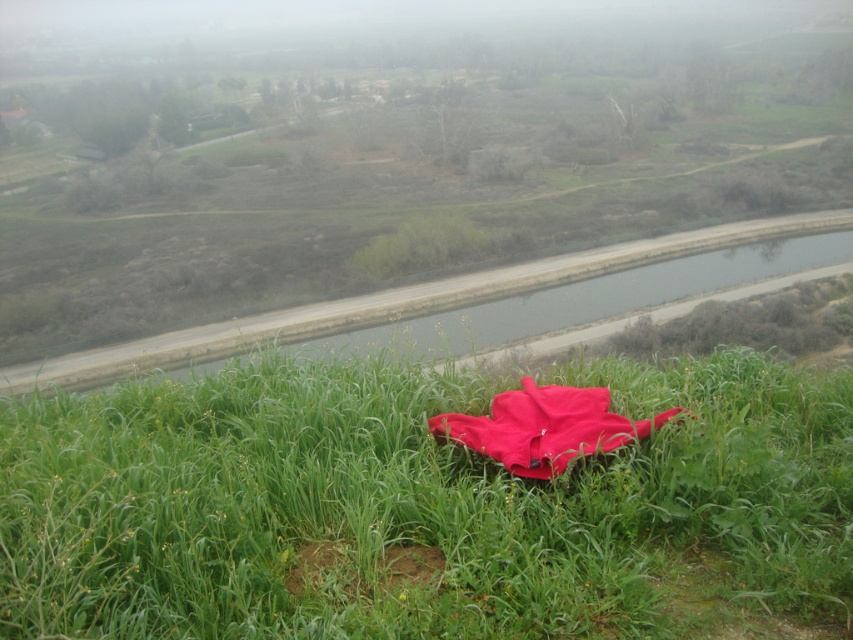
Who is more forward, (614, 413) or (357, 579)?

Point (357, 579)

Who is more distant from viewer, (547, 388) or (335, 560)?

Positioned behind is point (547, 388).

Identify the location of matte red blanket at center. (544, 428).

The width and height of the screenshot is (853, 640). I want to click on matte red blanket at center, so click(544, 428).

Who is positioned more to the left, matte red fabric at center or brown dirt patch at lower center?

From the viewer's perspective, brown dirt patch at lower center appears more on the left side.

Locate an element on the screen. This screenshot has height=640, width=853. matte red fabric at center is located at coordinates (424, 504).

Where is `matte red fabric at center`? The height and width of the screenshot is (640, 853). matte red fabric at center is located at coordinates (424, 504).

Between matte red fabric at center and matte red blanket at center, which one appears on the right side from the viewer's perspective?

Positioned to the right is matte red blanket at center.

Find the location of `matte red fabric at center`. matte red fabric at center is located at coordinates (424, 504).

Between point (717, 435) and point (512, 433), which one is positioned in front?

Positioned in front is point (717, 435).

At what (x,y) coordinates should I click in order to perform the action: click on matte red fabric at center. Please return your answer as a coordinate pair (x, y). The height and width of the screenshot is (640, 853). Looking at the image, I should click on (424, 504).